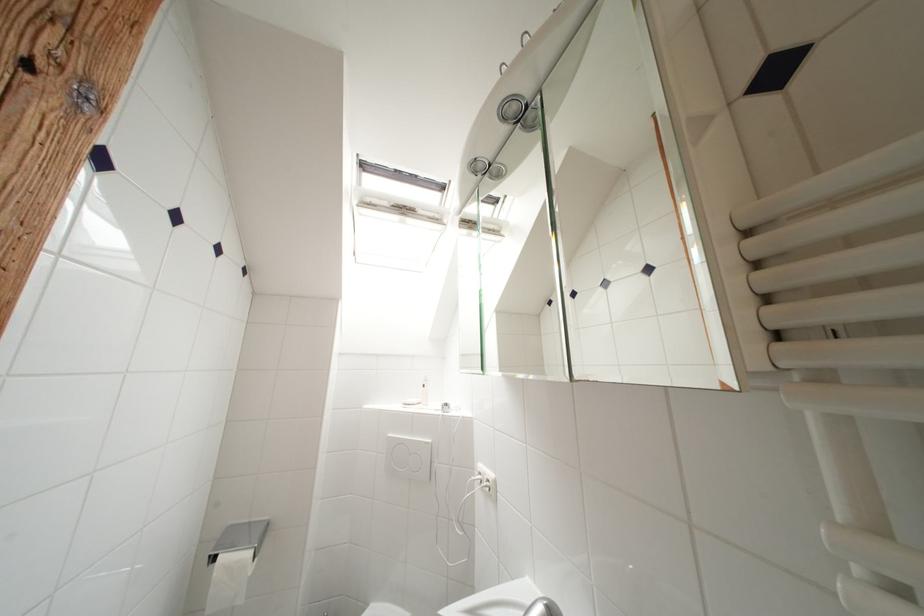
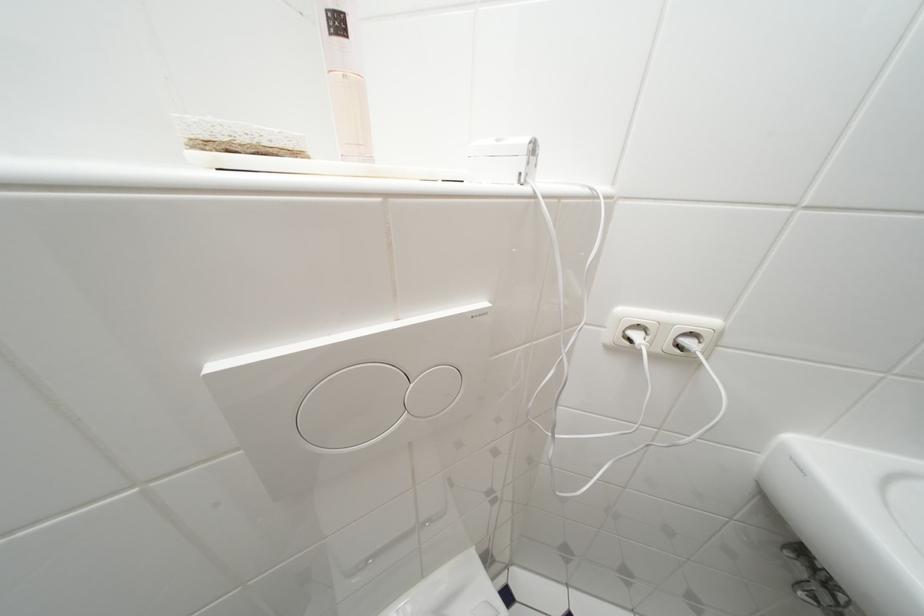
Question: I am providing you with two images of the same scene from different viewpoints. Please identify which objects are invisible in image2.

Choices:
 (A) large flush button
 (B) small flush button
 (C) white electrical plug
 (D) none of these

Answer: (D)